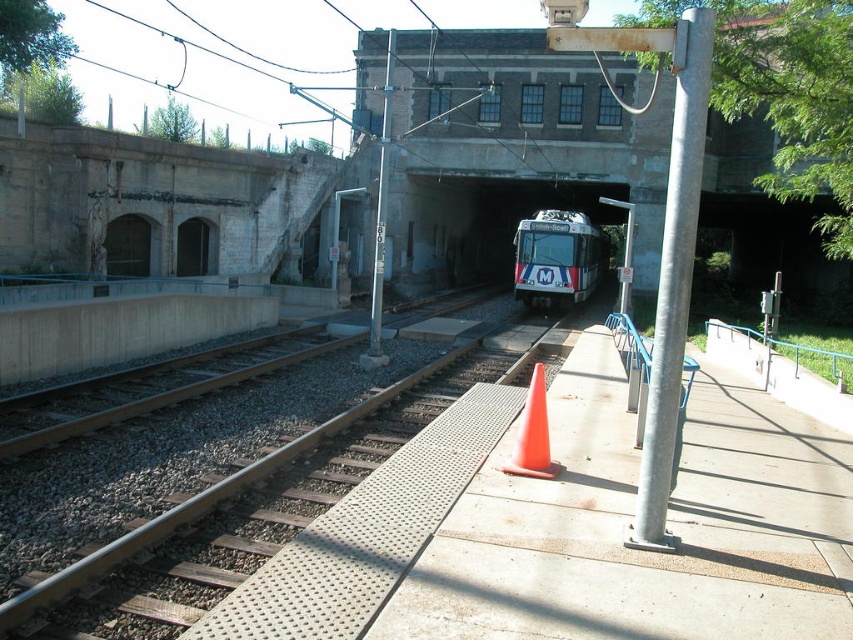
You are a pedestrian standing on the walkway next to the tracks. You see the white glossy train at center and the orange matte traffic cone at center. Which object is closer to you?

The white glossy train at center is positioned over the orange matte traffic cone at center, so the white glossy train at center is closer to you.

You are a photographer standing on the pedestrian walkway next to the tracks. You want to take a photo of the white glossy train at center and the orange matte traffic cone at center. Which object should you focus on first if you want to capture both in the frame without moving your camera?

The white glossy train at center has a larger size compared to the orange matte traffic cone at center, so you should focus on the white glossy train at center first to ensure it fills the frame appropriately before adjusting for the smaller traffic cone.

In the scene shown: You are a maintenance worker inspecting the railway. You notice the white glossy train at center and the brown gravel train track at center. Which object is taller?

The white glossy train at center is much taller than the brown gravel train track at center.